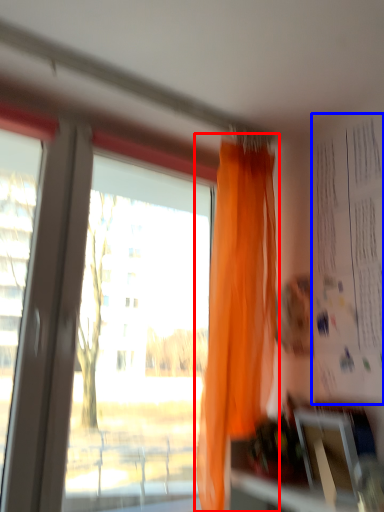
Question: Which of the following is the closest to the observer, curtain (highlighted by a red box) or bulletin board (highlighted by a blue box)?

Choices:
 (A) curtain
 (B) bulletin board

Answer: (B)